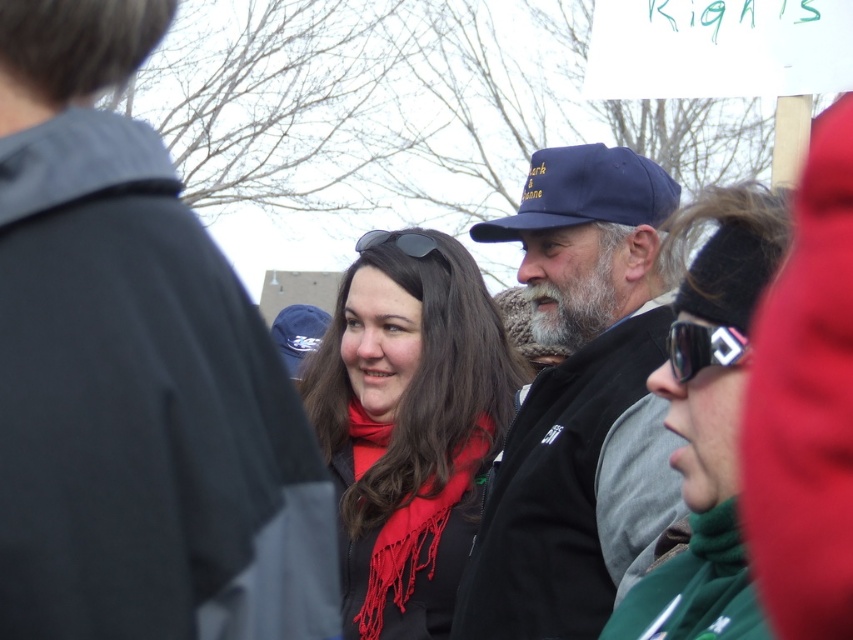
Question: Among these objects, which one is farthest from the camera?

Choices:
 (A) matte black sunglasses at center
 (B) blue fabric cap at center
 (C) matte black jacket at center
 (D) navy blue fabric baseball cap at center-right

Answer: (A)

Question: Which object is the farthest from the blue fabric cap at center?

Choices:
 (A) dark blue cap at center
 (B) matte black jacket at center
 (C) navy blue fabric baseball cap at center-right
 (D) black plastic goggles at right

Answer: (A)

Question: Which object is farther from the camera taking this photo?

Choices:
 (A) matte black jacket at center
 (B) blue fabric cap at center
 (C) dark blue cap at center

Answer: (B)

Question: Does navy blue fabric baseball cap at center-right come behind matte black sunglasses at center?

Choices:
 (A) no
 (B) yes

Answer: (A)

Question: Does blue fabric cap at center appear under matte black jacket at center?

Choices:
 (A) no
 (B) yes

Answer: (A)

Question: Can you confirm if matte black jacket at center is smaller than navy blue fabric baseball cap at center-right?

Choices:
 (A) no
 (B) yes

Answer: (A)